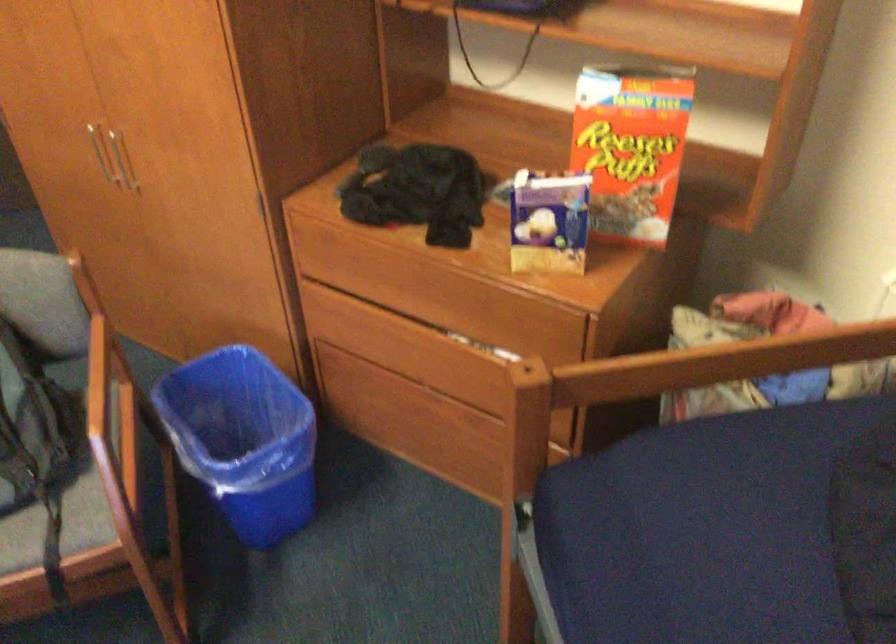
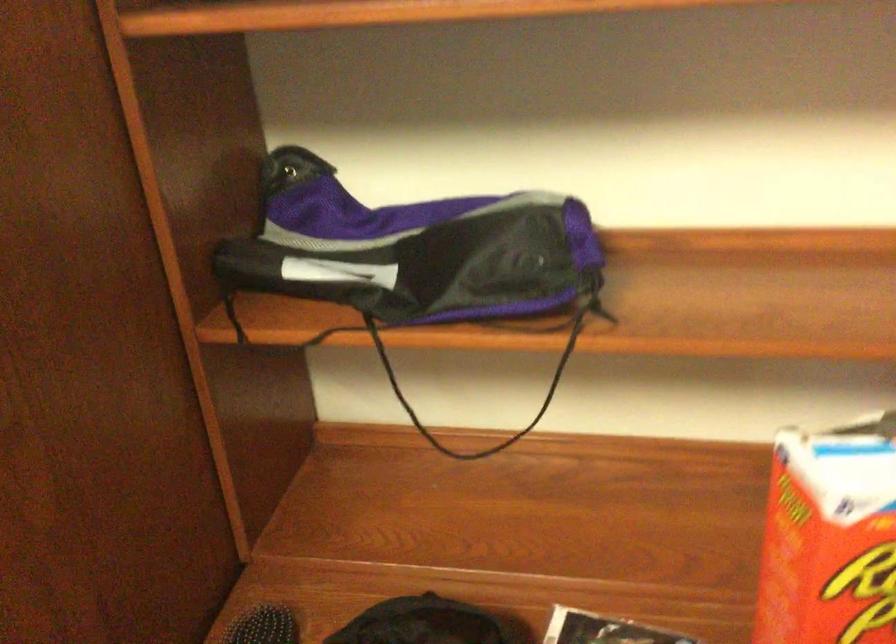
The point at (435, 146) is marked in the first image. Where is the corresponding point in the second image?

(419, 623)